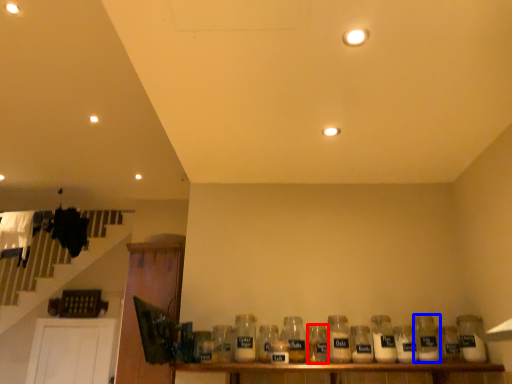
Question: Which object is closer to the camera taking this photo, bottle (highlighted by a red box) or bottle (highlighted by a blue box)?

Choices:
 (A) bottle
 (B) bottle

Answer: (A)